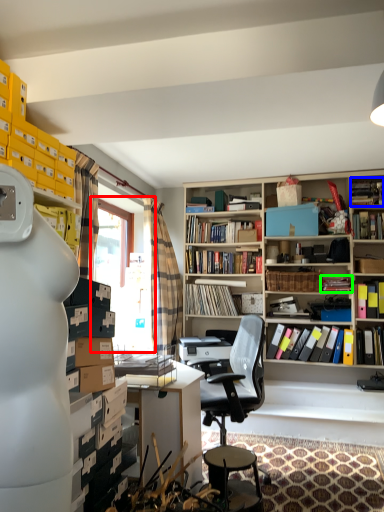
Question: Considering the real-world distances, which object is closest to window screen (highlighted by a red box)? book (highlighted by a blue box) or book (highlighted by a green box).

Choices:
 (A) book
 (B) book

Answer: (B)